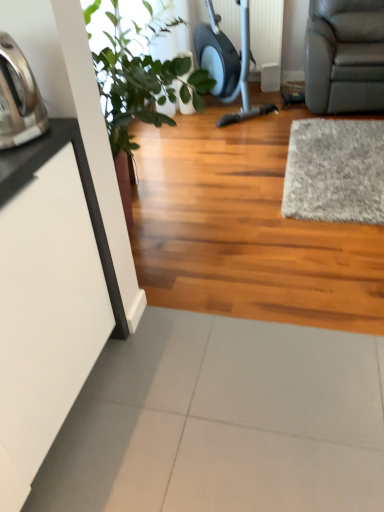
Question: From a real-world perspective, is brushed metal kettle at left physically located above or below gray shaggy rug at right?

Choices:
 (A) above
 (B) below

Answer: (A)

Question: Is brushed metal kettle at left inside the boundaries of gray shaggy rug at right, or outside?

Choices:
 (A) outside
 (B) inside

Answer: (A)

Question: Based on their relative distances, which object is nearer to the green leafy plant at upper left?

Choices:
 (A) brushed metal kettle at left
 (B) gray shaggy rug at right

Answer: (A)

Question: Which of these objects is positioned farthest from the gray shaggy rug at right?

Choices:
 (A) green leafy plant at upper left
 (B) brushed metal kettle at left

Answer: (B)